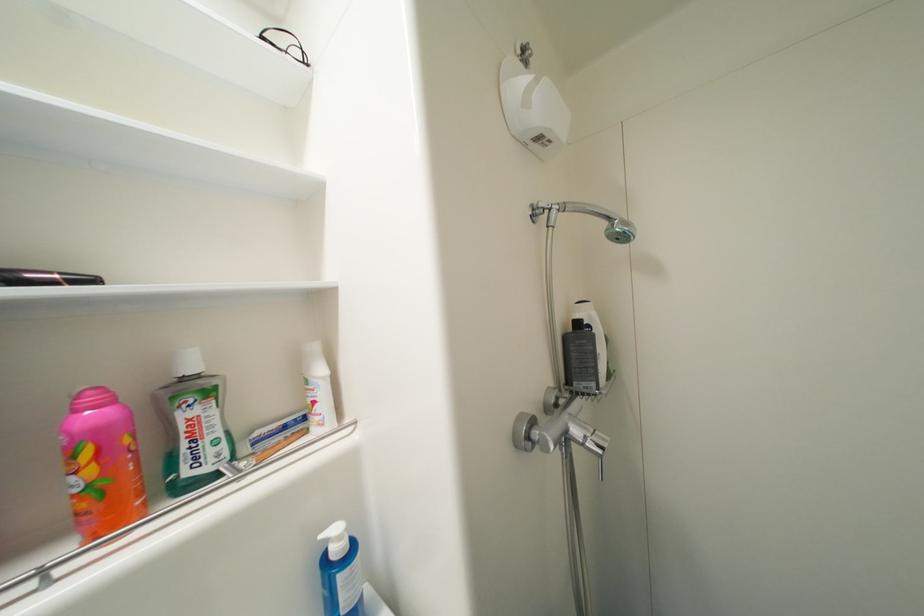
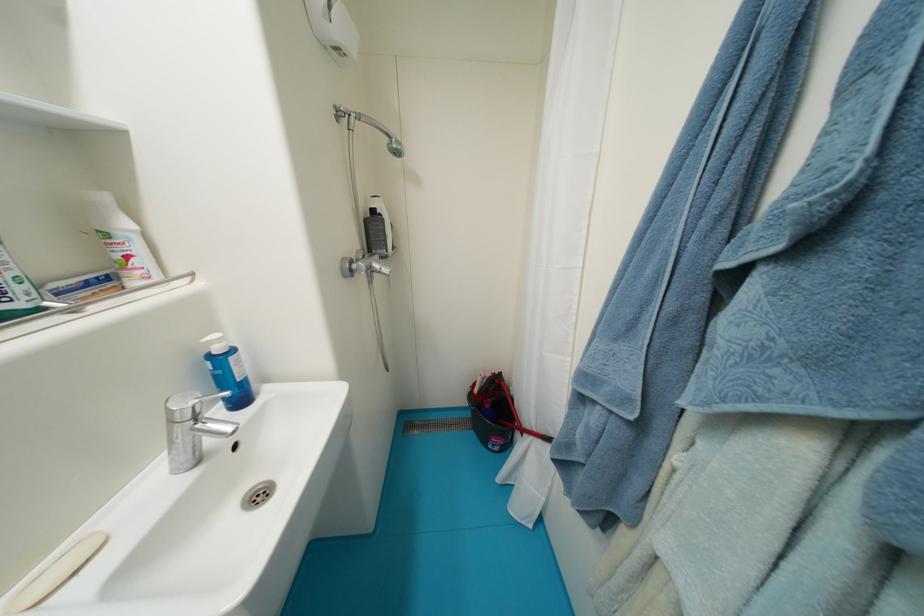
In the second image, find the point that corresponds to (x=263, y=436) in the first image.

(61, 286)